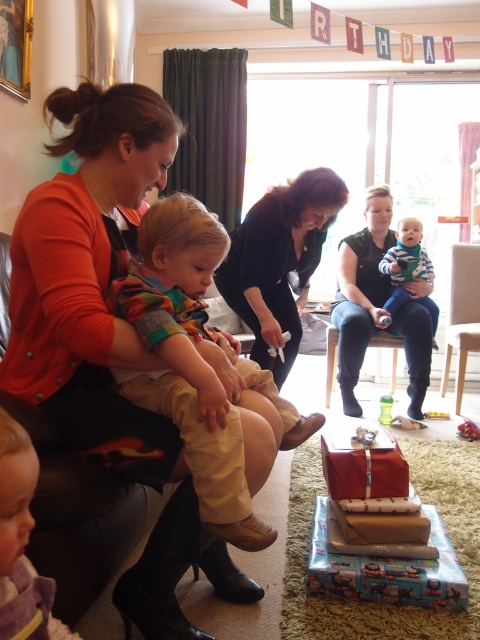
You are a guest at the birthday party and need to decide which item to take home as a souvenir. The light brown cotton pants at center and the black fabric at center are both available. If you prefer something shorter, which one should you choose?

The light brown cotton pants at center is shorter than the black fabric at center, so you should choose the light brown cotton pants at center.

You are standing in the living room and want to place a small gift box exactly where the black fabric at center is located. According to the coordinates provided, where should you place the gift box?

The black fabric at center is located at coordinates point (278, 260), so place the gift box there.